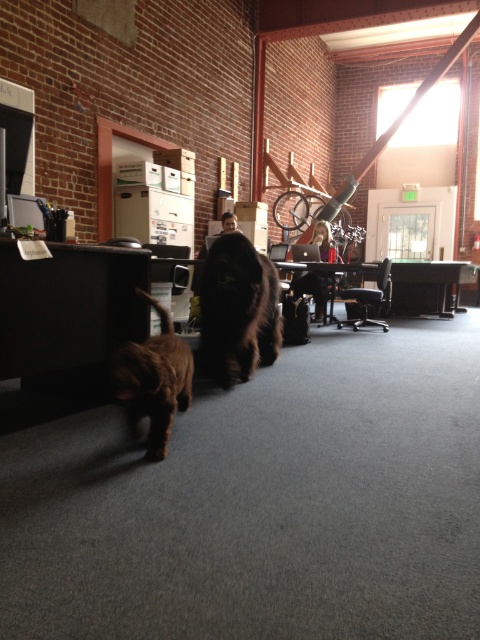
Question: Which object is the farthest from the black plastic computer at center?

Choices:
 (A) silver metallic laptop at center
 (B) brown furry dog at lower left
 (C) matte black monitor at center

Answer: (B)

Question: Which point is farther from the camera taking this photo?

Choices:
 (A) (43, 220)
 (B) (275, 248)
 (C) (153, 444)

Answer: (B)

Question: Can you confirm if matte black monitor at center is positioned above black plastic computer at center?

Choices:
 (A) no
 (B) yes

Answer: (A)

Question: Can you confirm if shiny brown fur at center is wider than brown furry dog at lower left?

Choices:
 (A) no
 (B) yes

Answer: (B)

Question: Is matte black monitor at center in front of black plastic computer at center?

Choices:
 (A) yes
 (B) no

Answer: (A)

Question: Estimate the real-world distances between objects in this image. Which object is farther from the matte black monitor at center?

Choices:
 (A) shiny brown fur at center
 (B) silver metallic laptop at center
 (C) black plastic computer at center

Answer: (C)